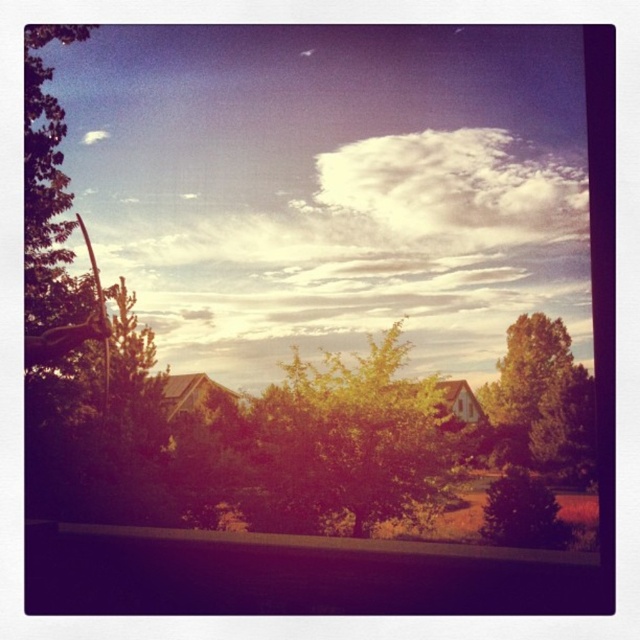
Who is more distant from viewer, [292,528] or [388,214]?

Point [388,214]

Between green leafy tree at center and white fluffy cloud at upper center, which one has less height?

With less height is green leafy tree at center.

Does point (317, 520) lie behind point (364, 205)?

No, it is not.

Identify the location of green leafy tree at center. The height and width of the screenshot is (640, 640). (348, 442).

Is point (552, 426) farther from viewer compared to point (538, 522)?

Yes, point (552, 426) is farther from viewer.

Does green leafy tree at right have a lesser height compared to green matte tree at lower right?

No.

Does point (541, 451) lie in front of point (541, 531)?

No, (541, 451) is further to viewer.

Locate an element on the screen. Image resolution: width=640 pixels, height=640 pixels. green leafy tree at right is located at coordinates (529, 392).

Consider the image. Which is above, green leafy tree at center or green matte tree at lower right?

green leafy tree at center is higher up.

Does green leafy tree at center appear under green matte tree at lower right?

No.

Measure the distance between green leafy tree at center and camera.

The distance of green leafy tree at center from camera is 16.45 meters.

Where is `green leafy tree at center`? This screenshot has width=640, height=640. green leafy tree at center is located at coordinates (348, 442).